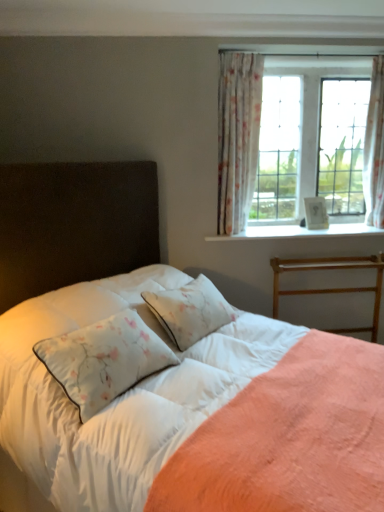
Question: From a real-world perspective, is white satin sheet at center physically above white floral fabric curtain at upper right, acting as the first curtain starting from the right?

Choices:
 (A) yes
 (B) no

Answer: (B)

Question: Is white satin sheet at center turned away from white floral fabric curtain at upper right, arranged as the 2th curtain when viewed from the left?

Choices:
 (A) yes
 (B) no

Answer: (B)

Question: Is white satin sheet at center aimed at white floral fabric curtain at upper right, arranged as the 2th curtain when viewed from the left?

Choices:
 (A) yes
 (B) no

Answer: (B)

Question: From the image's perspective, would you say white satin sheet at center is shown under white floral fabric curtain at upper right, arranged as the 2th curtain when viewed from the left?

Choices:
 (A) yes
 (B) no

Answer: (A)

Question: Are white satin sheet at center and white floral fabric curtain at upper right, acting as the first curtain starting from the right, far apart?

Choices:
 (A) no
 (B) yes

Answer: (B)

Question: Considering the relative sizes of white satin sheet at center and white floral fabric curtain at upper right, arranged as the 2th curtain when viewed from the left, in the image provided, is white satin sheet at center thinner than white floral fabric curtain at upper right, arranged as the 2th curtain when viewed from the left,?

Choices:
 (A) yes
 (B) no

Answer: (B)

Question: From the image's perspective, does floral sheer curtain at upper right, marked as the 2th curtain in a right-to-left arrangement, appear lower than wooden bed frame at right?

Choices:
 (A) no
 (B) yes

Answer: (A)

Question: Is floral sheer curtain at upper right, which appears as the first curtain when viewed from the left, smaller than wooden bed frame at right?

Choices:
 (A) yes
 (B) no

Answer: (A)

Question: Does floral sheer curtain at upper right, which appears as the first curtain when viewed from the left, lie in front of wooden bed frame at right?

Choices:
 (A) yes
 (B) no

Answer: (A)

Question: From a real-world perspective, is floral sheer curtain at upper right, which appears as the first curtain when viewed from the left, under wooden bed frame at right?

Choices:
 (A) yes
 (B) no

Answer: (B)

Question: Are floral sheer curtain at upper right, marked as the 2th curtain in a right-to-left arrangement, and wooden bed frame at right making contact?

Choices:
 (A) no
 (B) yes

Answer: (A)

Question: Is wooden bed frame at right inside floral sheer curtain at upper right, which appears as the first curtain when viewed from the left?

Choices:
 (A) yes
 (B) no

Answer: (B)

Question: From a real-world perspective, is white textured wood at upper right located higher than floral sheer curtain at upper right, marked as the 2th curtain in a right-to-left arrangement?

Choices:
 (A) yes
 (B) no

Answer: (B)